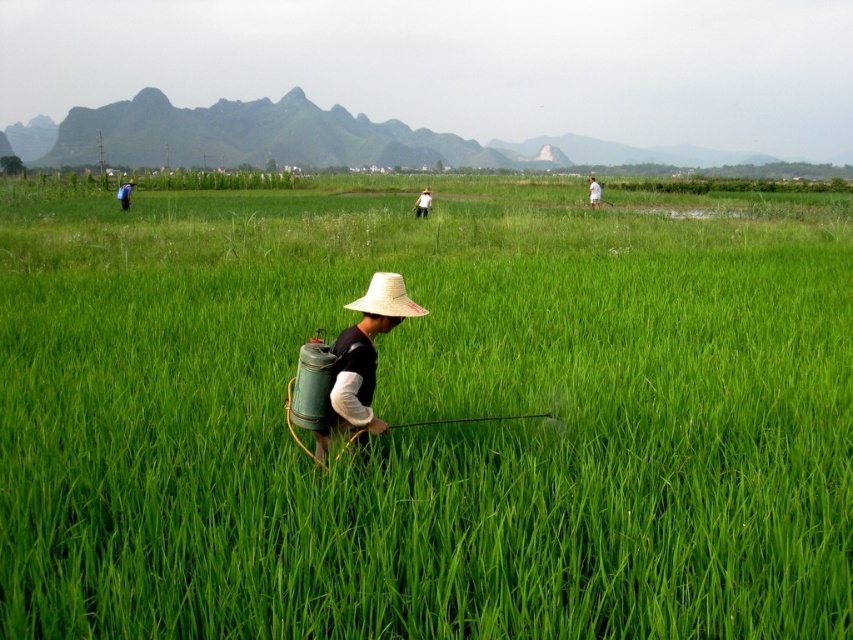
From the picture: Does green grass at center have a smaller size compared to matte straw hat at center?

No.

Is point (323, 276) positioned behind point (335, 401)?

That is True.

Is point (0, 264) positioned behind point (370, 348)?

Yes, point (0, 264) is farther from viewer.

What are the coordinates of `green grass at center` in the screenshot? It's located at (425, 419).

Which is below, matte straw hat at center or blue fabric shirt at left?

matte straw hat at center

Does point (312, 433) come behind point (120, 204)?

No, (312, 433) is in front of (120, 204).

This screenshot has height=640, width=853. I want to click on matte straw hat at center, so click(x=363, y=360).

Locate an element on the screen. matte straw hat at center is located at coordinates [363, 360].

Which is in front, point (543, 189) or point (370, 278)?

Point (370, 278)

From the picture: Who is taller, green grass at center or straw hat at center?

green grass at center

Is point (427, 480) positioned in front of point (399, 282)?

No.

The image size is (853, 640). What are the coordinates of `green grass at center` in the screenshot? It's located at (425, 419).